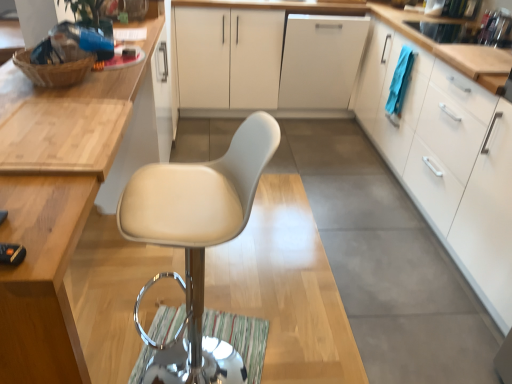
The width and height of the screenshot is (512, 384). In order to click on free space behind white leather chair at center in this screenshot , I will do `click(234, 299)`.